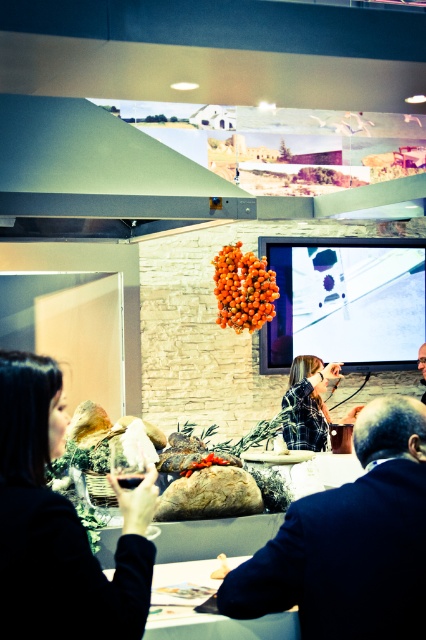
Which of these two, dark blue suit at center or matte black wine glass at lower left, stands taller?

Standing taller between the two is dark blue suit at center.

Does dark blue suit at center have a lesser height compared to matte black wine glass at lower left?

No.

Between point (371, 634) and point (34, 566), which one is positioned behind?

Positioned behind is point (371, 634).

Locate an element on the screen. dark blue suit at center is located at coordinates (351, 541).

Is dark blue suit at center taller than plaid fabric shirt at center?

In fact, dark blue suit at center may be shorter than plaid fabric shirt at center.

Which is in front, point (411, 464) or point (302, 406)?

Point (411, 464) is in front.

You are a GUI agent. You are given a task and a screenshot of the screen. Output one action in this format:
    pyautogui.click(x=<x>, y=<y>)
    Task: Click on the dark blue suit at center
    
    Given the screenshot: What is the action you would take?
    pyautogui.click(x=351, y=541)

Does point (247, 589) come in front of point (213, 580)?

Yes, it is.

Which of these two, dark blue suit at center or smooth wooden table at lower center, stands taller?

With more height is dark blue suit at center.

Is point (359, 440) closer to viewer compared to point (190, 570)?

Yes, it is in front of point (190, 570).

Identify the location of dark blue suit at center. (351, 541).